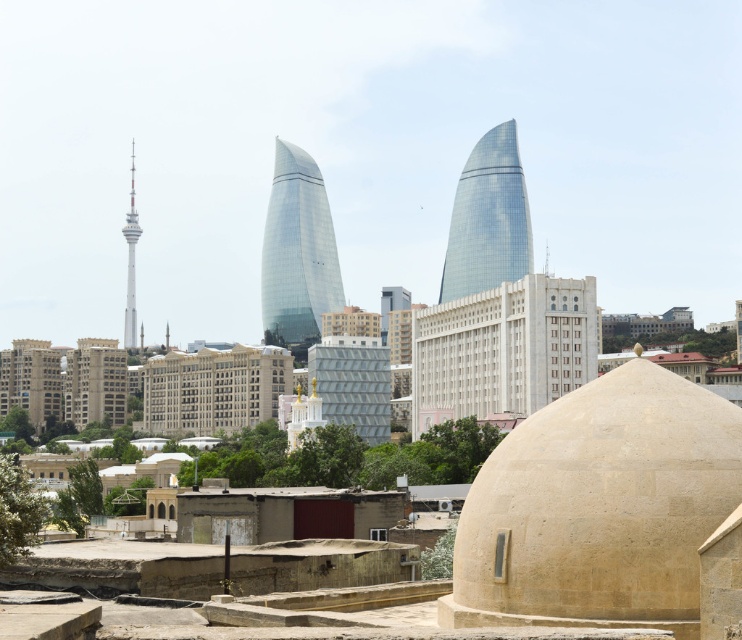
Can you confirm if beige stone dome at center is shorter than metallic silver tower at left?

→ Correct, beige stone dome at center is not as tall as metallic silver tower at left.

Who is lower down, beige stone dome at center or metallic silver tower at left?

beige stone dome at center is below.

Between point (548, 435) and point (128, 234), which one is positioned in front?

Positioned in front is point (548, 435).

You are a GUI agent. You are given a task and a screenshot of the screen. Output one action in this format:
    pyautogui.click(x=<x>, y=<y>)
    Task: Click on the beige stone dome at center
    The height and width of the screenshot is (640, 742).
    Given the screenshot: What is the action you would take?
    pyautogui.click(x=600, y=508)

In the scene shown: Who is shorter, transparent glass tower at center or glassy blue tower at center?

glassy blue tower at center

Does transparent glass tower at center appear under glassy blue tower at center?

Indeed, transparent glass tower at center is positioned under glassy blue tower at center.

Which is behind, point (266, 276) or point (459, 289)?

The point (266, 276) is behind.

Where is `transparent glass tower at center`? The height and width of the screenshot is (640, 742). transparent glass tower at center is located at coordinates (298, 253).

Locate an element on the screen. transparent glass tower at center is located at coordinates tap(298, 253).

What do you see at coordinates (298, 253) in the screenshot? I see `transparent glass tower at center` at bounding box center [298, 253].

Find the location of a particular element. The image size is (742, 640). transparent glass tower at center is located at coordinates (298, 253).